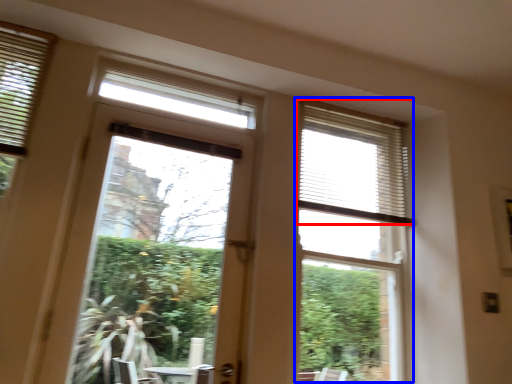
Question: Which point is further to the camera, blind (highlighted by a red box) or bay window (highlighted by a blue box)?

Choices:
 (A) blind
 (B) bay window

Answer: (A)